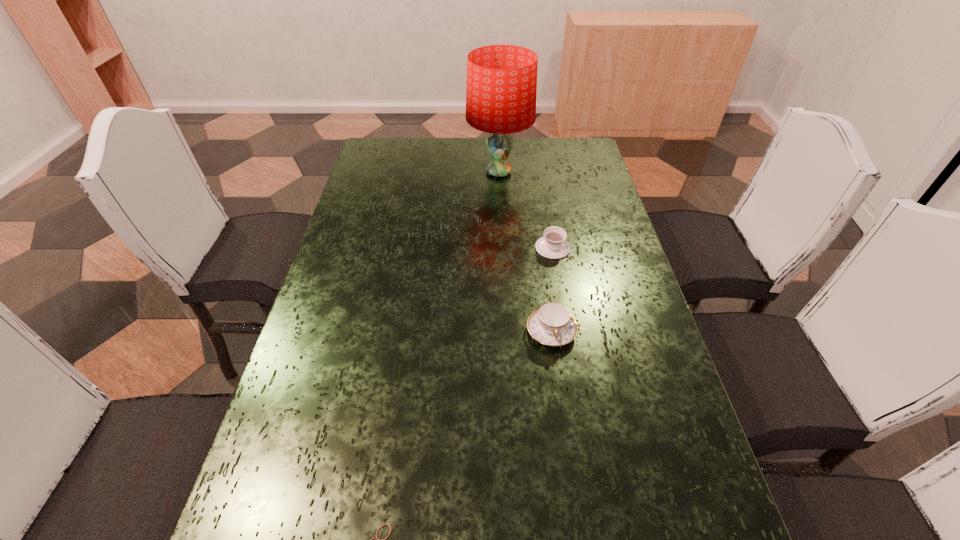
Identify the location of the tallest object. (501, 90).

Find the location of a particular element. This screenshot has height=540, width=960. lampshade is located at coordinates (501, 90).

This screenshot has height=540, width=960. I want to click on the taller teacup, so click(552, 324).

Where is `the third farthest object`? the third farthest object is located at coordinates (552, 324).

The height and width of the screenshot is (540, 960). I want to click on the shorter teacup, so click(x=553, y=245).

The image size is (960, 540). I want to click on the farther teacup, so click(x=553, y=245).

Find the location of a particular element. The image size is (960, 540). vacant space located on the front-facing side of the tallest object is located at coordinates (427, 172).

The width and height of the screenshot is (960, 540). I want to click on free region located 0.360m on the front-facing side of the tallest object, so click(364, 172).

You are a GUI agent. You are given a task and a screenshot of the screen. Output one action in this format:
    pyautogui.click(x=<x>, y=<y>)
    Task: Click on the vacant space located 0.330m on the front-facing side of the tallest object
    
    Given the screenshot: What is the action you would take?
    pyautogui.click(x=372, y=172)

Find the location of a particular element. vacant space situated on the side with the handle of the nearer teacup is located at coordinates (577, 513).